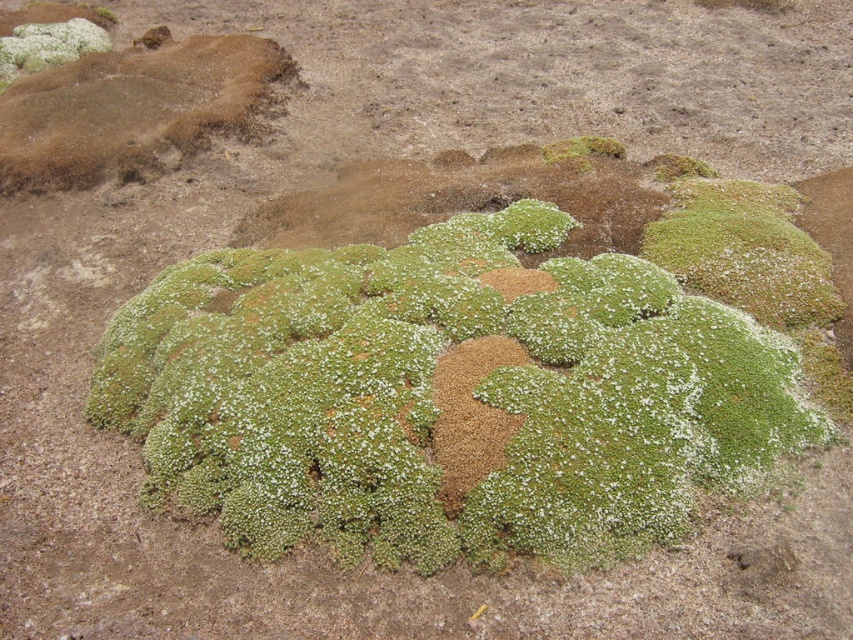
Which is below, green mossy mound at center or green fuzzy moss at upper center?

Positioned lower is green mossy mound at center.

Who is positioned more to the right, green mossy mound at center or green fuzzy moss at upper center?

Positioned to the right is green fuzzy moss at upper center.

The width and height of the screenshot is (853, 640). Identify the location of green mossy mound at center. (456, 200).

The width and height of the screenshot is (853, 640). I want to click on green mossy mound at center, so click(456, 200).

Is point (35, 54) behind point (595, 148)?

Yes, it is.

Is the position of green fuzzy plant at upper left less distant than that of green fuzzy moss at upper center?

No.

Does point (78, 42) lie behind point (563, 154)?

Yes, point (78, 42) is behind point (563, 154).

You are a GUI agent. You are given a task and a screenshot of the screen. Output one action in this format:
    pyautogui.click(x=<x>, y=<y>)
    Task: Click on the green fuzzy plant at upper left
    This screenshot has height=640, width=853.
    Given the screenshot: What is the action you would take?
    pyautogui.click(x=48, y=45)

Between green mossy mound at upper left and green fuzzy plant at upper left, which one is positioned higher?

green fuzzy plant at upper left

Locate an element on the screen. The image size is (853, 640). green mossy mound at upper left is located at coordinates (132, 109).